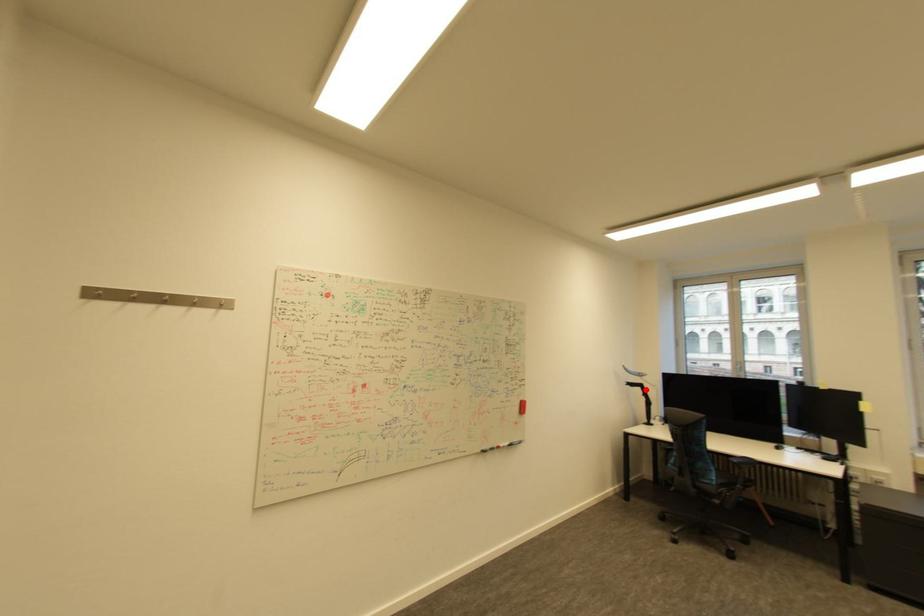
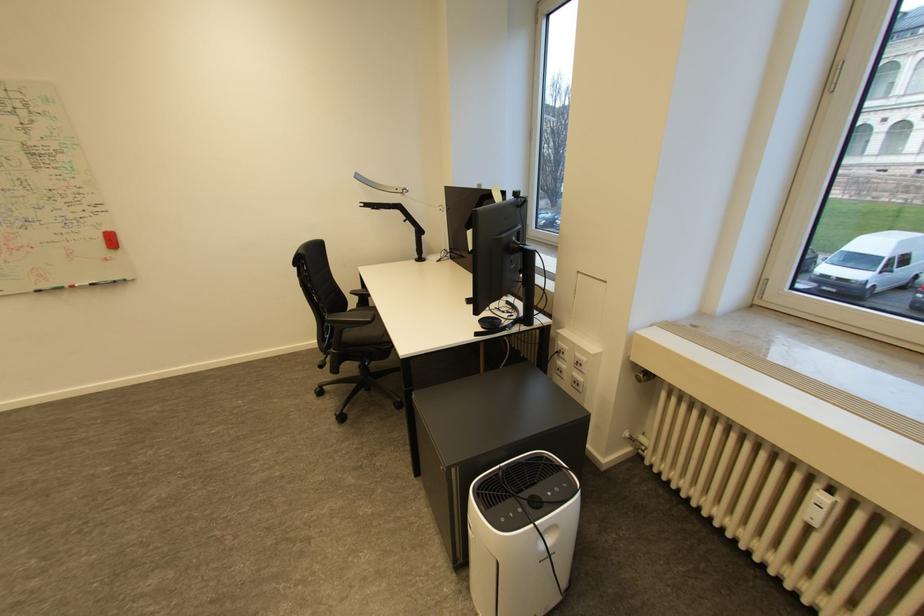
Question: I am providing you with two images of the same scene from different viewpoints. Image1 has a red point marked. In image2, the corresponding 3D location appears at what relative position? Reply with the corresponding letter.

Choices:
 (A) Closer
 (B) Farther

Answer: (A)